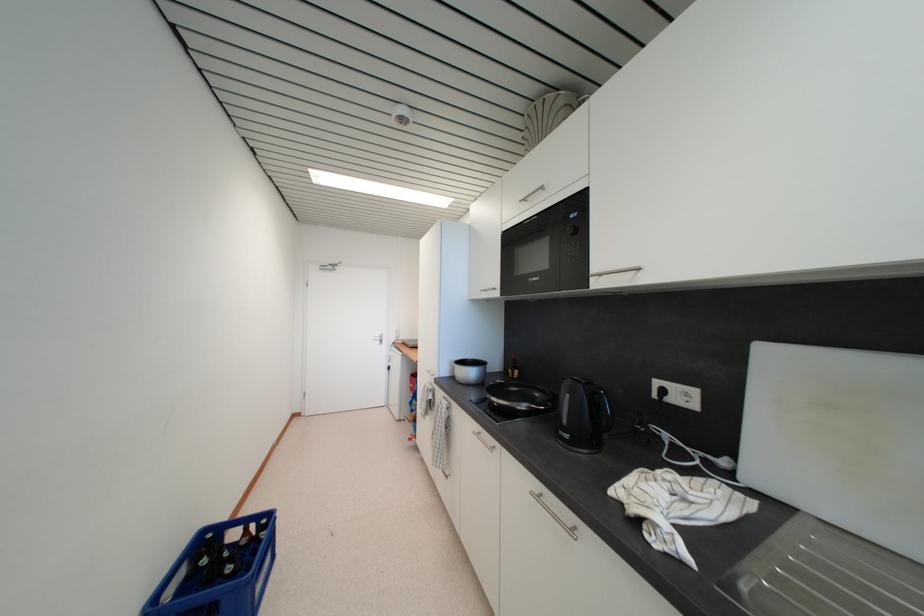
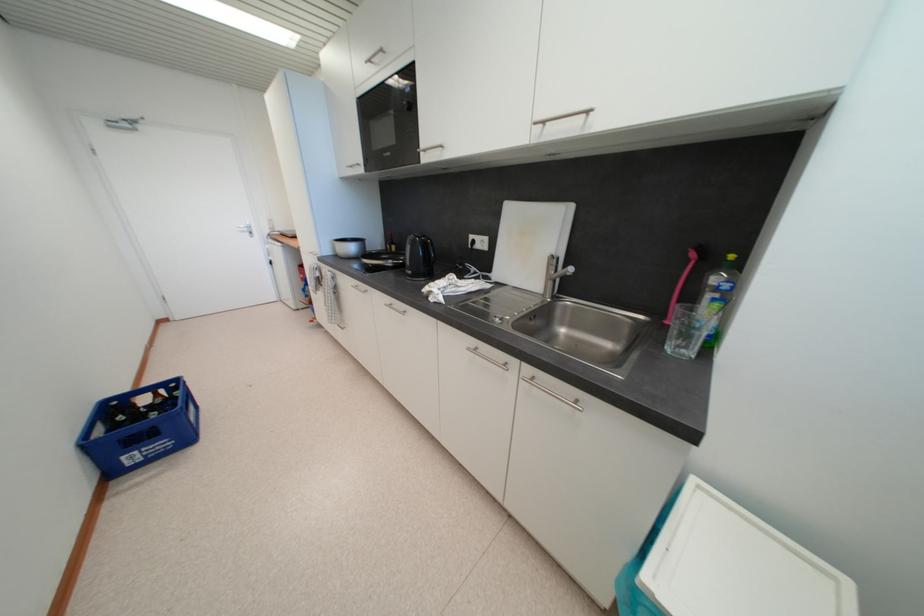
Find the pixel in the second image that matches pixel 529 203 in the first image.

(375, 63)